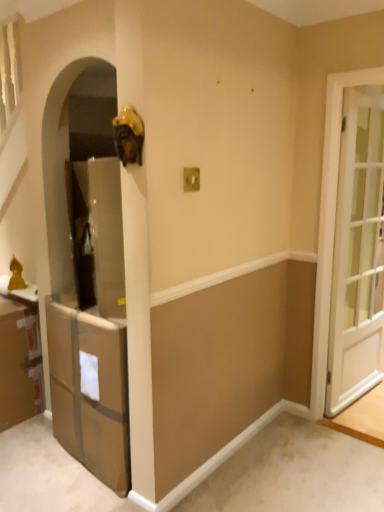
Consider the image. In order to face white glossy door at right, should I rotate leftwards or rightwards?

Turn right by 22.360 degrees to look at white glossy door at right.

The image size is (384, 512). What do you see at coordinates (19, 362) in the screenshot? I see `brown cardboard cabinet at lower left, positioned as the first cabinetry in left-to-right order` at bounding box center [19, 362].

I want to click on white glossy door at right, so click(x=358, y=252).

Would you consider brown cardboard cabinet at lower left, which is counted as the second cabinetry, starting from the left, to be distant from brown cardboard cabinet at lower left, the 2th cabinetry from the right?

No, brown cardboard cabinet at lower left, which is counted as the second cabinetry, starting from the left, is not far from brown cardboard cabinet at lower left, the 2th cabinetry from the right.

Can you confirm if brown cardboard cabinet at lower left, which is counted as the second cabinetry, starting from the left, is wider than brown cardboard cabinet at lower left, positioned as the first cabinetry in left-to-right order?

Yes, brown cardboard cabinet at lower left, which is counted as the second cabinetry, starting from the left, is wider than brown cardboard cabinet at lower left, positioned as the first cabinetry in left-to-right order.

From a real-world perspective, which is physically below, brown cardboard cabinet at lower left, which is counted as the second cabinetry, starting from the left, or brown cardboard cabinet at lower left, the 2th cabinetry from the right?

brown cardboard cabinet at lower left, the 2th cabinetry from the right, is physically lower.

Considering the positions of objects brown cardboard cabinet at lower left, which is counted as the second cabinetry, starting from the left, and brown cardboard cabinet at lower left, the 2th cabinetry from the right, in the image provided, who is behind, brown cardboard cabinet at lower left, which is counted as the second cabinetry, starting from the left, or brown cardboard cabinet at lower left, the 2th cabinetry from the right,?

brown cardboard cabinet at lower left, the 2th cabinetry from the right, is behind.

Which of these two, white glossy door at right or brown cardboard cabinet at lower left, which is counted as the second cabinetry, starting from the left, is smaller?

Smaller between the two is white glossy door at right.

Where is `the 2nd cabinetry below when counting from the white glossy door at right (from the image's perspective)`? Image resolution: width=384 pixels, height=512 pixels. the 2nd cabinetry below when counting from the white glossy door at right (from the image's perspective) is located at coordinates (90, 391).

From a real-world perspective, who is located higher, white glossy door at right or brown cardboard cabinet at lower left, acting as the first cabinetry starting from the right?

white glossy door at right.

Is white glossy door at right at the right side of brown cardboard cabinet at lower left, which is counted as the second cabinetry, starting from the left?

Indeed, white glossy door at right is positioned on the right side of brown cardboard cabinet at lower left, which is counted as the second cabinetry, starting from the left.

Is brown cardboard cabinet at lower left, positioned as the first cabinetry in left-to-right order, closer to the viewer compared to white glossy door at right?

No, brown cardboard cabinet at lower left, positioned as the first cabinetry in left-to-right order, is further to the viewer.

From the image's perspective, between brown cardboard cabinet at lower left, positioned as the first cabinetry in left-to-right order, and white glossy door at right, which one is located above?

white glossy door at right appears higher in the image.

Which of these two, brown cardboard cabinet at lower left, the 2th cabinetry from the right, or white glossy door at right, stands shorter?

With less height is brown cardboard cabinet at lower left, the 2th cabinetry from the right.

From the picture: Could you measure the distance between brown cardboard cabinet at lower left, the 2th cabinetry from the right, and white glossy door at right?

The distance of brown cardboard cabinet at lower left, the 2th cabinetry from the right, from white glossy door at right is 6.24 feet.

In the scene shown: From the image's perspective, which is above, brown cardboard cabinet at lower left, positioned as the first cabinetry in left-to-right order, or brown cardboard cabinet at lower left, acting as the first cabinetry starting from the right?

From the image's view, brown cardboard cabinet at lower left, positioned as the first cabinetry in left-to-right order, is above.

Does brown cardboard cabinet at lower left, the 2th cabinetry from the right, have a larger size compared to brown cardboard cabinet at lower left, which is counted as the second cabinetry, starting from the left?

No, brown cardboard cabinet at lower left, the 2th cabinetry from the right, is not bigger than brown cardboard cabinet at lower left, which is counted as the second cabinetry, starting from the left.

Is brown cardboard cabinet at lower left, positioned as the first cabinetry in left-to-right order, facing towards brown cardboard cabinet at lower left, which is counted as the second cabinetry, starting from the left?

No, brown cardboard cabinet at lower left, positioned as the first cabinetry in left-to-right order, is not aimed at brown cardboard cabinet at lower left, which is counted as the second cabinetry, starting from the left.

Between brown cardboard cabinet at lower left, positioned as the first cabinetry in left-to-right order, and brown cardboard cabinet at lower left, acting as the first cabinetry starting from the right, which one has smaller width?

brown cardboard cabinet at lower left, positioned as the first cabinetry in left-to-right order, is thinner.

From the image's perspective, is white glossy door at right on brown cardboard cabinet at lower left, positioned as the first cabinetry in left-to-right order?

Indeed, from the image's perspective, white glossy door at right is shown above brown cardboard cabinet at lower left, positioned as the first cabinetry in left-to-right order.

Does white glossy door at right touch brown cardboard cabinet at lower left, the 2th cabinetry from the right?

No, white glossy door at right is not making contact with brown cardboard cabinet at lower left, the 2th cabinetry from the right.

From a real-world perspective, is white glossy door at right positioned above or below brown cardboard cabinet at lower left, positioned as the first cabinetry in left-to-right order?

Clearly, from a real-world perspective, white glossy door at right is above brown cardboard cabinet at lower left, positioned as the first cabinetry in left-to-right order.

Would you say white glossy door at right is outside brown cardboard cabinet at lower left, positioned as the first cabinetry in left-to-right order?

Absolutely, white glossy door at right is external to brown cardboard cabinet at lower left, positioned as the first cabinetry in left-to-right order.

How many degrees apart are the facing directions of brown cardboard cabinet at lower left, acting as the first cabinetry starting from the right, and white glossy door at right?

There is a 90-degree angle between the facing directions of brown cardboard cabinet at lower left, acting as the first cabinetry starting from the right, and white glossy door at right.

Is brown cardboard cabinet at lower left, which is counted as the second cabinetry, starting from the left, wider or thinner than white glossy door at right?

Considering their sizes, brown cardboard cabinet at lower left, which is counted as the second cabinetry, starting from the left, looks broader than white glossy door at right.

From the image's perspective, is brown cardboard cabinet at lower left, which is counted as the second cabinetry, starting from the left, beneath white glossy door at right?

Yes, from the image's perspective, brown cardboard cabinet at lower left, which is counted as the second cabinetry, starting from the left, is below white glossy door at right.

Consider the image. Considering their positions, is brown cardboard cabinet at lower left, acting as the first cabinetry starting from the right, located in front of or behind white glossy door at right?

Visually, brown cardboard cabinet at lower left, acting as the first cabinetry starting from the right, is located in front of white glossy door at right.

Locate an element on the screen. The height and width of the screenshot is (512, 384). cabinetry in front of the brown cardboard cabinet at lower left, the 2th cabinetry from the right is located at coordinates (90, 391).

Locate an element on the screen. This screenshot has height=512, width=384. door lying on the right of brown cardboard cabinet at lower left, acting as the first cabinetry starting from the right is located at coordinates (358, 252).

Which object lies nearer to the anchor point brown cardboard cabinet at lower left, which is counted as the second cabinetry, starting from the left, brown cardboard cabinet at lower left, positioned as the first cabinetry in left-to-right order, or white glossy door at right?

brown cardboard cabinet at lower left, positioned as the first cabinetry in left-to-right order.

Based on their spatial positions, is brown cardboard cabinet at lower left, the 2th cabinetry from the right, or brown cardboard cabinet at lower left, acting as the first cabinetry starting from the right, closer to white glossy door at right?

brown cardboard cabinet at lower left, acting as the first cabinetry starting from the right, is positioned closer to the anchor white glossy door at right.

From the image, which object appears to be farther from brown cardboard cabinet at lower left, the 2th cabinetry from the right, brown cardboard cabinet at lower left, which is counted as the second cabinetry, starting from the left, or white glossy door at right?

white glossy door at right is positioned further to the anchor brown cardboard cabinet at lower left, the 2th cabinetry from the right.

Based on their spatial positions, is brown cardboard cabinet at lower left, which is counted as the second cabinetry, starting from the left, or brown cardboard cabinet at lower left, positioned as the first cabinetry in left-to-right order, further from white glossy door at right?

Among the two, brown cardboard cabinet at lower left, positioned as the first cabinetry in left-to-right order, is located further to white glossy door at right.

When comparing their distances from brown cardboard cabinet at lower left, positioned as the first cabinetry in left-to-right order, does white glossy door at right or brown cardboard cabinet at lower left, acting as the first cabinetry starting from the right, seem further?

Based on the image, white glossy door at right appears to be further to brown cardboard cabinet at lower left, positioned as the first cabinetry in left-to-right order.

From the image, which object appears to be farther from brown cardboard cabinet at lower left, which is counted as the second cabinetry, starting from the left, white glossy door at right or brown cardboard cabinet at lower left, the 2th cabinetry from the right?

The object further to brown cardboard cabinet at lower left, which is counted as the second cabinetry, starting from the left, is white glossy door at right.

The image size is (384, 512). I want to click on cabinetry between brown cardboard cabinet at lower left, the 2th cabinetry from the right, and white glossy door at right from left to right, so click(90, 391).